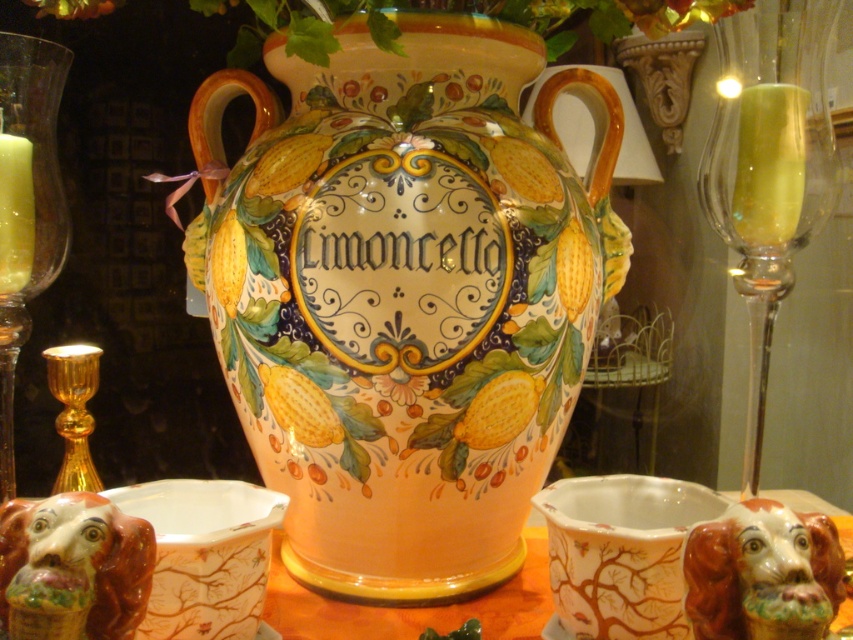
You are arranging flowers in the matte ceramic vase at center and need to place a gold metallic candle holder at left next to it. Based on the scene description, which side of the vase should you place the candle holder to ensure it is positioned correctly?

The matte ceramic vase at center is to the right of the gold metallic candle holder at left, so you should place the candle holder to the left of the vase.

You are arranging a dinner table and want to place a 30 cm wide centerpiece between the matte ceramic vase at center and the gold metallic candle holder at left. Will there be enough space?

The distance between the matte ceramic vase at center and the gold metallic candle holder at left is 29.00 centimeters. Since the centerpiece is 30 cm wide, it will not fit in the available space.